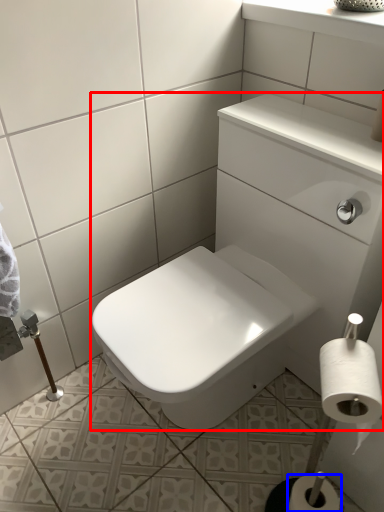
Question: Among these objects, which one is nearest to the camera, sink (highlighted by a red box) or toilet paper (highlighted by a blue box)?

Choices:
 (A) sink
 (B) toilet paper

Answer: (A)